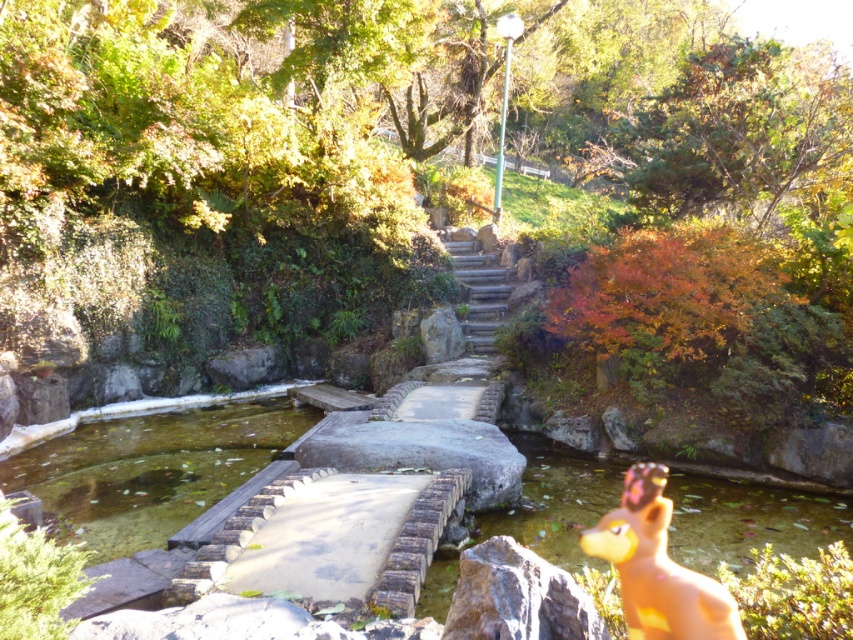
Who is positioned more to the right, smooth gray rock at lower right or stone steps at center?

stone steps at center is more to the right.

The width and height of the screenshot is (853, 640). Find the location of `smooth gray rock at lower right`. smooth gray rock at lower right is located at coordinates (517, 596).

Is the position of light brown plastic toy at lower right more distant than that of stone steps at center?

No, it is not.

Who is more forward, (695, 582) or (469, 266)?

Positioned in front is point (695, 582).

You are a GUI agent. You are given a task and a screenshot of the screen. Output one action in this format:
    pyautogui.click(x=<x>, y=<y>)
    Task: Click on the light brown plastic toy at lower right
    The height and width of the screenshot is (640, 853).
    Given the screenshot: What is the action you would take?
    pyautogui.click(x=657, y=566)

Who is taller, light brown plastic toy at lower right or smooth gray rock at lower right?

With more height is light brown plastic toy at lower right.

The image size is (853, 640). I want to click on light brown plastic toy at lower right, so click(x=657, y=566).